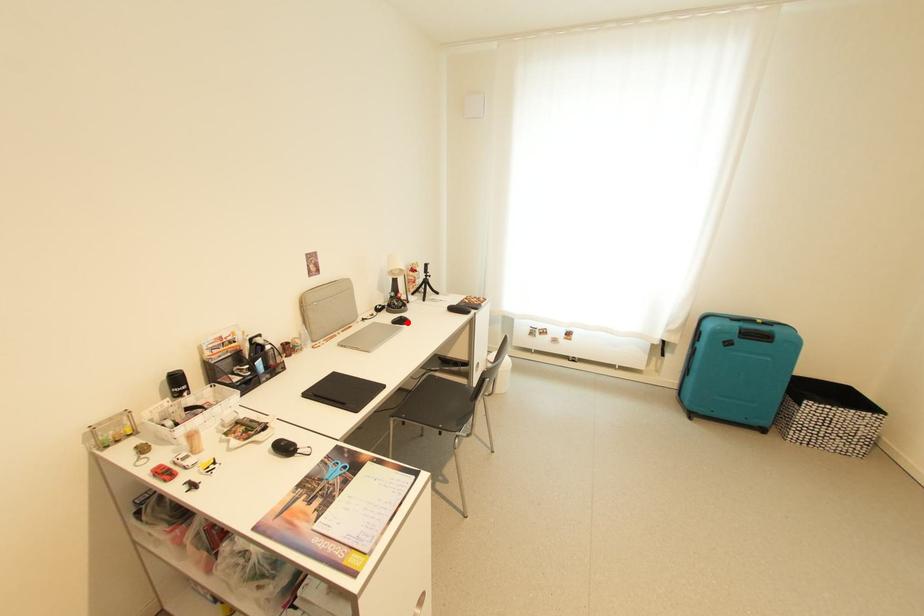
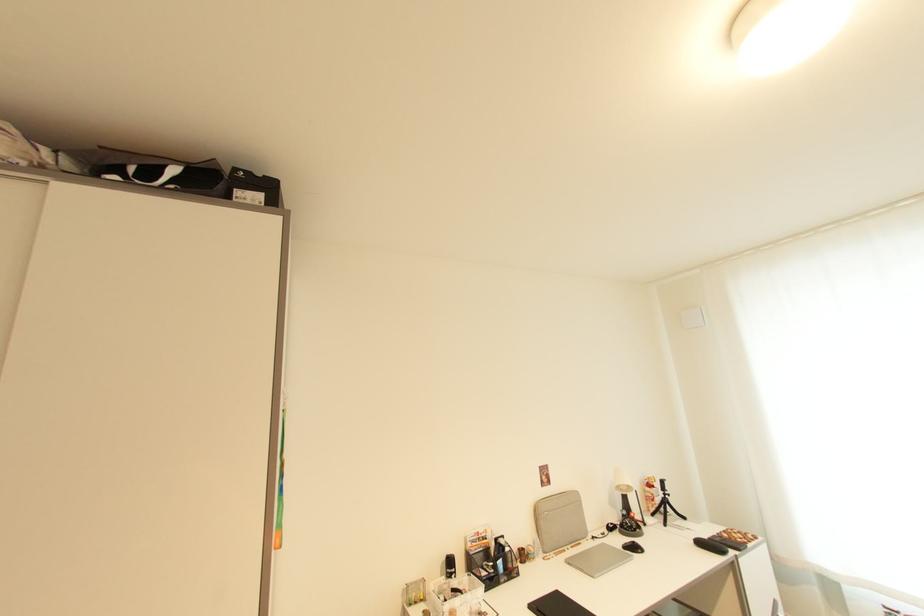
Locate, in the second image, the point that corresponds to the highlighted location in the first image.

(639, 549)